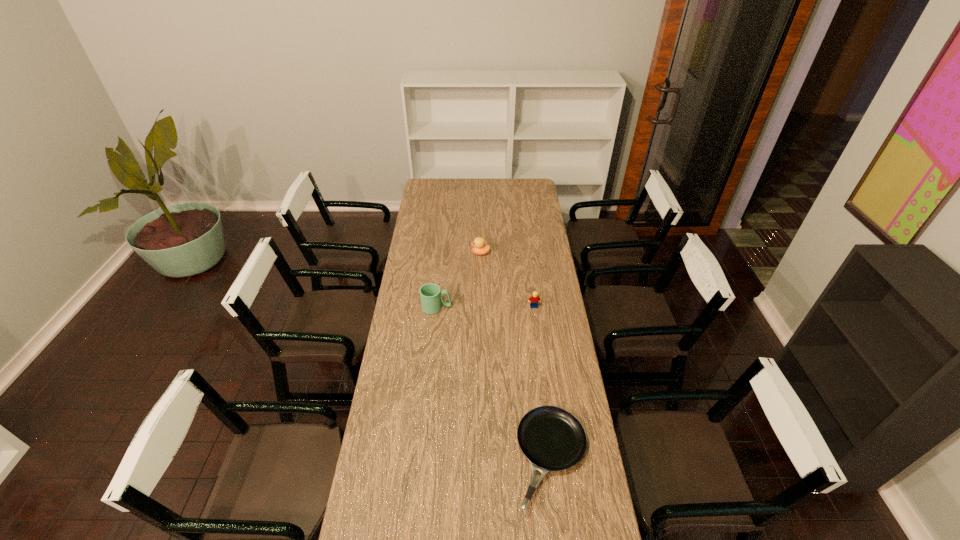
Identify the location of vacant point located between the shortest object and the Lego. The width and height of the screenshot is (960, 540). (543, 383).

The image size is (960, 540). I want to click on free space between the duckling and the leftmost object, so pos(459,280).

Where is `vacant point located between the Lego and the nearest object`? vacant point located between the Lego and the nearest object is located at coordinates (543, 383).

What are the coordinates of `free spot between the nearest object and the duckling` in the screenshot? It's located at (516, 356).

Identify the location of vacant space in between the second object from left to right and the leftmost object. The width and height of the screenshot is (960, 540). (459, 280).

Where is `free space that is in between the shortest object and the Lego`? The height and width of the screenshot is (540, 960). free space that is in between the shortest object and the Lego is located at coordinates coord(543,383).

Locate an element on the screen. Image resolution: width=960 pixels, height=540 pixels. unoccupied area between the shortest object and the duckling is located at coordinates (516, 356).

Where is `empty space that is in between the tallest object and the Lego`? The width and height of the screenshot is (960, 540). empty space that is in between the tallest object and the Lego is located at coordinates (485, 307).

Locate an element on the screen. This screenshot has height=540, width=960. free space between the Lego and the leftmost object is located at coordinates (485, 307).

Identify the location of vacant area that lies between the pan and the Lego. This screenshot has width=960, height=540. click(543, 383).